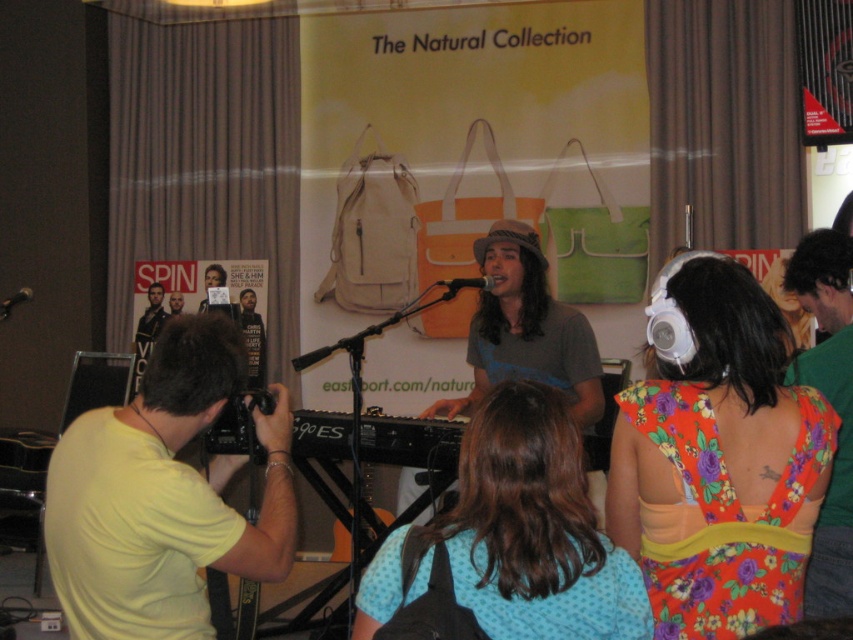
Question: Can you confirm if blue polka dot shirt at center is positioned to the right of matte black poster at center?

Choices:
 (A) yes
 (B) no

Answer: (A)

Question: Does yellow matte shirt at left have a lesser width compared to matte black jacket at center?

Choices:
 (A) yes
 (B) no

Answer: (B)

Question: Which is nearer to the matte black jacket at center?

Choices:
 (A) matte black poster at center
 (B) floral fabric dress at center
 (C) blue polka dot shirt at center

Answer: (A)

Question: Which object is closer to the camera taking this photo?

Choices:
 (A) floral fabric dress at center
 (B) matte black poster at center

Answer: (A)

Question: Can you confirm if matte black poster at center is positioned above smooth skin face at center?

Choices:
 (A) no
 (B) yes

Answer: (A)

Question: Among these objects, which one is farthest from the camera?

Choices:
 (A) matte black poster at center
 (B) blue polka dot shirt at center
 (C) yellow matte shirt at left

Answer: (A)